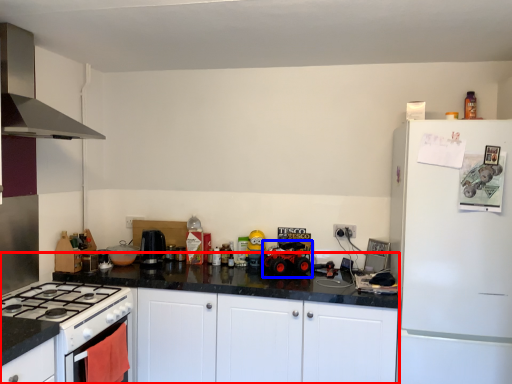
Question: Among these objects, which one is farthest to the camera, counter (highlighted by a red box) or toy car (highlighted by a blue box)?

Choices:
 (A) counter
 (B) toy car

Answer: (B)